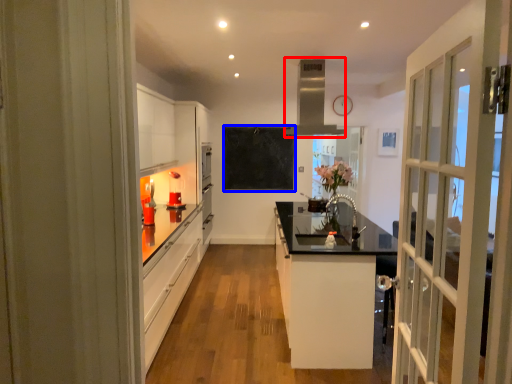
Question: Which object is closer to the camera taking this photo, exhaust hood (highlighted by a red box) or bulletin board (highlighted by a blue box)?

Choices:
 (A) exhaust hood
 (B) bulletin board

Answer: (A)